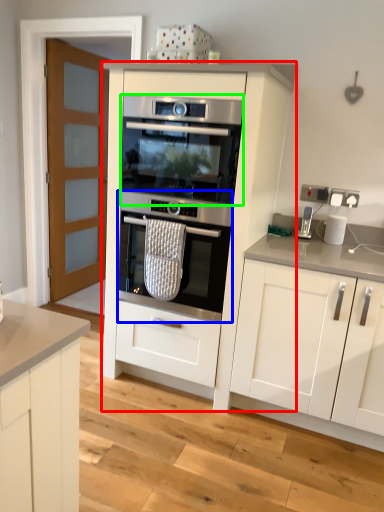
Question: Which is farther away from cabinetry (highlighted by a red box)? oven (highlighted by a blue box) or oven (highlighted by a green box)?

Choices:
 (A) oven
 (B) oven

Answer: (B)